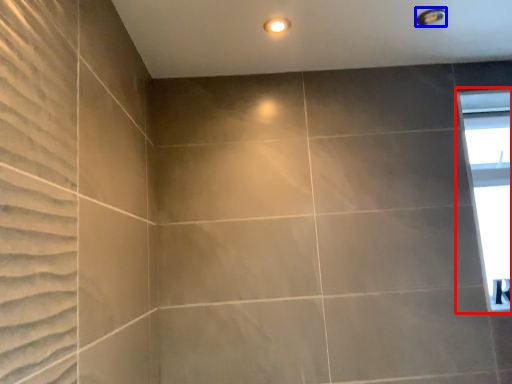
Question: Which of the following is the closest to the observer, window (highlighted by a red box) or shower (highlighted by a blue box)?

Choices:
 (A) window
 (B) shower

Answer: (B)